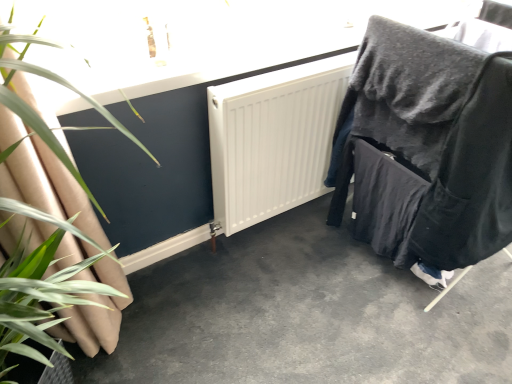
Identify the location of free space between velvet black chair at right and green leafy plant at left. The image size is (512, 384). 286,291.